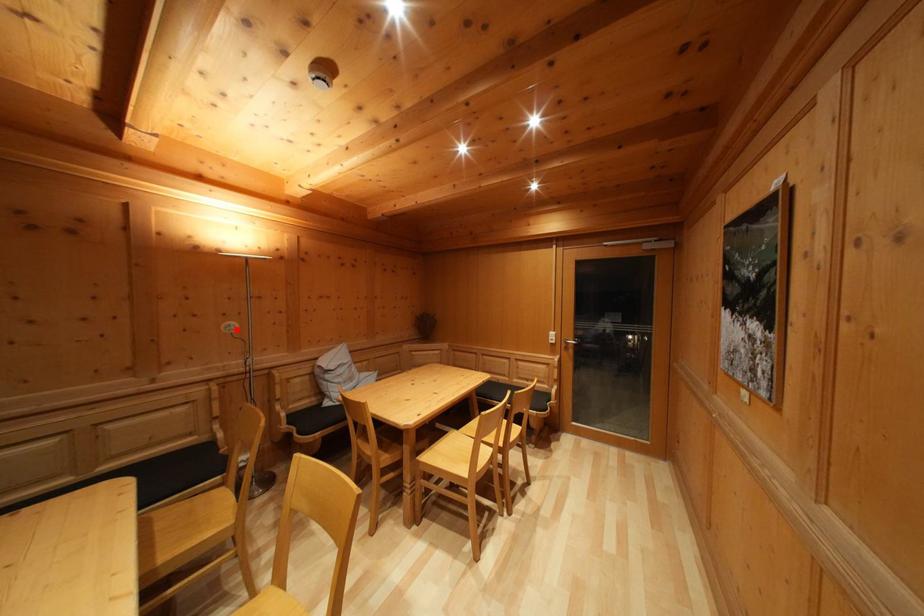
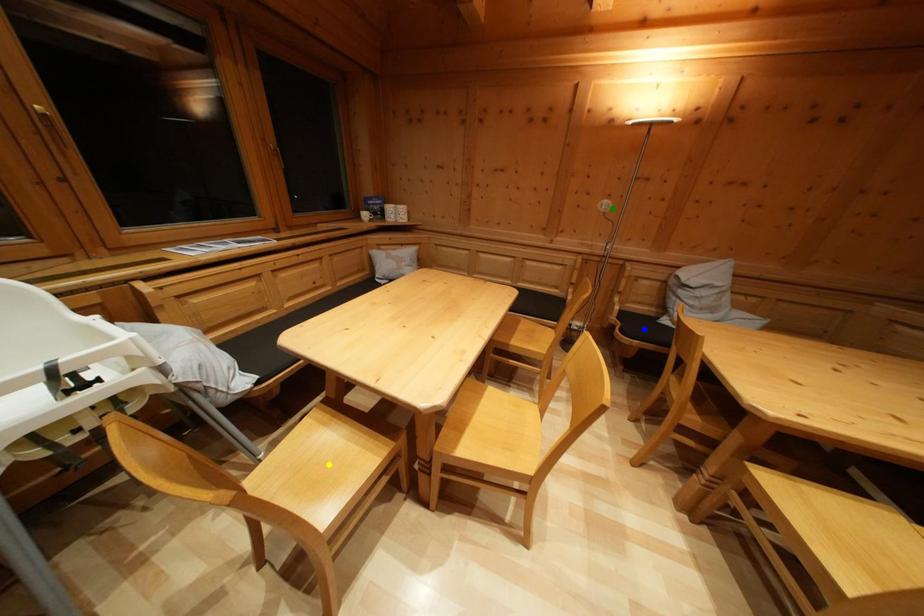
Question: I am providing you with two images of the same scene from different viewpoints. A red point is marked on the first image. You are given multiple points on the second image. Which mark in image 2 goes with the point in image 1?

Choices:
 (A) green point
 (B) blue point
 (C) yellow point

Answer: (A)